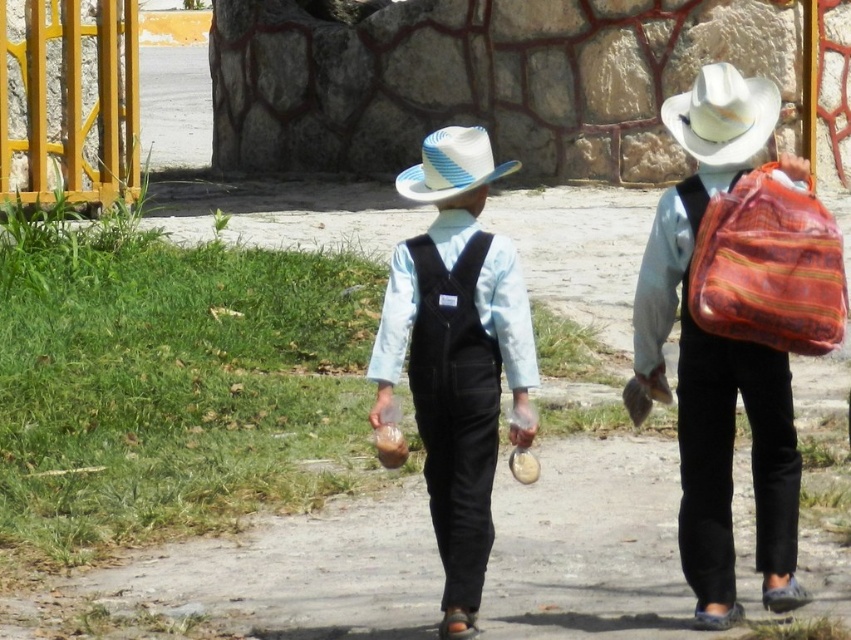
Is matte straw hat at center thinner than textured woven bag at right?

No, matte straw hat at center is not thinner than textured woven bag at right.

Between point (437, 536) and point (797, 344), which one is positioned in front?

Point (797, 344)

Find the location of a particular element. Image resolution: width=851 pixels, height=640 pixels. matte straw hat at center is located at coordinates (457, 353).

Can you confirm if matte orange fabric bag at right is shorter than blue and white striped straw hat at center?

No, matte orange fabric bag at right is not shorter than blue and white striped straw hat at center.

Who is taller, matte orange fabric bag at right or blue and white striped straw hat at center?

matte orange fabric bag at right

Identify the location of matte orange fabric bag at right. The width and height of the screenshot is (851, 640). (717, 362).

You are a GUI agent. You are given a task and a screenshot of the screen. Output one action in this format:
    pyautogui.click(x=<x>, y=<y>)
    Task: Click on the matte orange fabric bag at right
    
    Given the screenshot: What is the action you would take?
    click(x=717, y=362)

Is white woven hat at upper right below blue and white striped straw hat at center?

Incorrect, white woven hat at upper right is not positioned below blue and white striped straw hat at center.

Looking at this image, can you confirm if white woven hat at upper right is positioned to the right of blue and white striped straw hat at center?

Correct, you'll find white woven hat at upper right to the right of blue and white striped straw hat at center.

Is point (718, 106) closer to camera compared to point (432, 170)?

That is True.

Where is `white woven hat at upper right`? white woven hat at upper right is located at coordinates (722, 115).